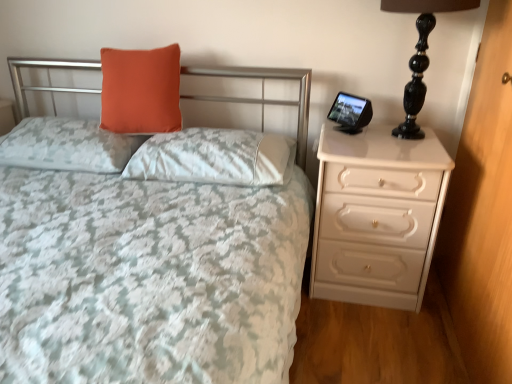
Locate an element on the screen. black glossy table lamp at right is located at coordinates (420, 55).

What do you see at coordinates (263, 94) in the screenshot? This screenshot has height=384, width=512. I see `matte white bedspread at center` at bounding box center [263, 94].

Locate an element on the screen. The height and width of the screenshot is (384, 512). orange fabric pillow at upper left, which ranks as the third pillow in right-to-left order is located at coordinates (67, 145).

What do you see at coordinates (377, 216) in the screenshot?
I see `white glossy chest of drawers at right` at bounding box center [377, 216].

Where is `orange matte pillow at upper center, marked as the second pillow in a right-to-left arrangement`? The height and width of the screenshot is (384, 512). orange matte pillow at upper center, marked as the second pillow in a right-to-left arrangement is located at coordinates (141, 90).

Image resolution: width=512 pixels, height=384 pixels. What are the coordinates of `bed directly beneath the white glossy dresser at right (from a real-world perspective)` in the screenshot? It's located at (263, 94).

Does point (205, 70) lie in front of point (487, 288)?

No, (205, 70) is further to viewer.

Is matte white bedspread at center beside white glossy dresser at right?

No, matte white bedspread at center is not in contact with white glossy dresser at right.

Which object is thinner, white glossy dresser at right or orange matte pillow at upper center, marked as the second pillow in a right-to-left arrangement?

Thinner between the two is white glossy dresser at right.

Is white glossy dresser at right spatially inside orange matte pillow at upper center, marked as the second pillow in a right-to-left arrangement, or outside of it?

white glossy dresser at right lies outside orange matte pillow at upper center, marked as the second pillow in a right-to-left arrangement.

Is point (473, 125) closer to viewer compared to point (131, 56)?

Yes, it is in front of point (131, 56).

Starting from the white glossy dresser at right, which pillow is the 2nd one to the left? Please provide its 2D coordinates.

[(141, 90)]

How different are the orientations of white glossy dresser at right and black glossy table lamp at right in degrees?

90.1 degrees.

From the picture: Which object is closer to the camera, white glossy dresser at right or black glossy table lamp at right?

white glossy dresser at right is more forward.

Between white glossy dresser at right and black glossy table lamp at right, which one appears on the left side from the viewer's perspective?

black glossy table lamp at right.

Is white glossy dresser at right positioned far away from black glossy table lamp at right?

white glossy dresser at right is actually quite close to black glossy table lamp at right.

Which object is closer to the camera taking this photo, white satin pillow at center, the 1th pillow in the right-to-left sequence, or white glossy dresser at right?

white glossy dresser at right.

Is white glossy dresser at right at the back of white satin pillow at center, which is the 3th pillow from left to right?

white satin pillow at center, which is the 3th pillow from left to right, is not turned away from white glossy dresser at right.

Are white satin pillow at center, which is the 3th pillow from left to right, and white glossy dresser at right located far from each other?

No, white satin pillow at center, which is the 3th pillow from left to right, is not far away from white glossy dresser at right.

How far apart are orange fabric pillow at upper left, which ranks as the third pillow in right-to-left order, and matte white bedspread at center?

orange fabric pillow at upper left, which ranks as the third pillow in right-to-left order, is 25.08 inches away from matte white bedspread at center.

Is orange fabric pillow at upper left, which ranks as the third pillow in right-to-left order, bigger or smaller than matte white bedspread at center?

Clearly, orange fabric pillow at upper left, which ranks as the third pillow in right-to-left order, is smaller in size than matte white bedspread at center.

Considering the relative positions of orange fabric pillow at upper left, which ranks as the third pillow in right-to-left order, and matte white bedspread at center in the image provided, is orange fabric pillow at upper left, which ranks as the third pillow in right-to-left order, in front of matte white bedspread at center?

No, it is not.

Which of these two, orange fabric pillow at upper left, which ranks as the third pillow in right-to-left order, or matte white bedspread at center, stands shorter?

orange fabric pillow at upper left, which ranks as the third pillow in right-to-left order, is shorter.

From the image's perspective, who appears lower, orange fabric pillow at upper left, acting as the first pillow starting from the left, or white glossy chest of drawers at right?

white glossy chest of drawers at right, from the image's perspective.

Which is behind, point (80, 129) or point (334, 260)?

The point (80, 129) is farther from the camera.

Do you think orange fabric pillow at upper left, which ranks as the third pillow in right-to-left order, is within white glossy chest of drawers at right, or outside of it?

The correct answer is: outside.

Which object is positioned more to the right, white satin pillow at center, which is the 3th pillow from left to right, or white glossy chest of drawers at right?

white glossy chest of drawers at right.

How many degrees apart are the facing directions of white satin pillow at center, which is the 3th pillow from left to right, and white glossy chest of drawers at right?

white satin pillow at center, which is the 3th pillow from left to right, and white glossy chest of drawers at right are facing 0.333 degrees away from each other.

Would you say white satin pillow at center, which is the 3th pillow from left to right, is outside white glossy chest of drawers at right?

Indeed, white satin pillow at center, which is the 3th pillow from left to right, is completely outside white glossy chest of drawers at right.

From the image's perspective, is white satin pillow at center, which is the 3th pillow from left to right, above white glossy chest of drawers at right?

Indeed, from the image's perspective, white satin pillow at center, which is the 3th pillow from left to right, is shown above white glossy chest of drawers at right.

This screenshot has width=512, height=384. Find the location of `bed below the white glossy dresser at right (from a real-world perspective)`. bed below the white glossy dresser at right (from a real-world perspective) is located at coordinates (263, 94).

The width and height of the screenshot is (512, 384). I want to click on the 3rd pillow behind the white glossy dresser at right, counting from the anchor's position, so click(141, 90).

Based on their spatial positions, is orange fabric pillow at upper left, which ranks as the third pillow in right-to-left order, or white glossy dresser at right further from white glossy chest of drawers at right?

orange fabric pillow at upper left, which ranks as the third pillow in right-to-left order, is further to white glossy chest of drawers at right.

When comparing their distances from white glossy chest of drawers at right, does white glossy dresser at right or black glossy table lamp at right seem further?

Based on the image, black glossy table lamp at right appears to be further to white glossy chest of drawers at right.

Estimate the real-world distances between objects in this image. Which object is further from white glossy chest of drawers at right, orange fabric pillow at upper left, acting as the first pillow starting from the left, or black glossy table lamp at right?

Among the two, orange fabric pillow at upper left, acting as the first pillow starting from the left, is located further to white glossy chest of drawers at right.

From the image, which object appears to be farther from orange matte pillow at upper center, marked as the second pillow in a right-to-left arrangement, matte white bedspread at center or white glossy dresser at right?

white glossy dresser at right.

Estimate the real-world distances between objects in this image. Which object is closer to white satin pillow at center, which is the 3th pillow from left to right, orange matte pillow at upper center, marked as the second pillow in a right-to-left arrangement, or black glossy table lamp at right?

Among the two, orange matte pillow at upper center, marked as the second pillow in a right-to-left arrangement, is located nearer to white satin pillow at center, which is the 3th pillow from left to right.

Which object lies further to the anchor point matte white bedspread at center, orange matte pillow at upper center, marked as the second pillow in a right-to-left arrangement, or white satin pillow at center, the 1th pillow in the right-to-left sequence?

The object further to matte white bedspread at center is white satin pillow at center, the 1th pillow in the right-to-left sequence.

Based on their spatial positions, is white glossy chest of drawers at right or white satin pillow at center, which is the 3th pillow from left to right, further from orange matte pillow at upper center, marked as the second pillow in a right-to-left arrangement?

white glossy chest of drawers at right is further to orange matte pillow at upper center, marked as the second pillow in a right-to-left arrangement.

When comparing their distances from white satin pillow at center, which is the 3th pillow from left to right, does white glossy chest of drawers at right or white glossy dresser at right seem further?

Among the two, white glossy dresser at right is located further to white satin pillow at center, which is the 3th pillow from left to right.

Find the location of `pillow between orange fabric pillow at upper left, which ranks as the third pillow in right-to-left order, and white satin pillow at center, the 1th pillow in the right-to-left sequence, from left to right`. pillow between orange fabric pillow at upper left, which ranks as the third pillow in right-to-left order, and white satin pillow at center, the 1th pillow in the right-to-left sequence, from left to right is located at coordinates (141, 90).

This screenshot has height=384, width=512. What are the coordinates of `table lamp between matte white bedspread at center and white satin pillow at center, the 1th pillow in the right-to-left sequence, from front to back` in the screenshot? It's located at (420, 55).

What are the coordinates of `table lamp between white satin pillow at center, the 1th pillow in the right-to-left sequence, and white glossy dresser at right` in the screenshot? It's located at (420, 55).

Locate an element on the screen. The image size is (512, 384). table lamp situated between matte white bedspread at center and white glossy dresser at right from left to right is located at coordinates (420, 55).